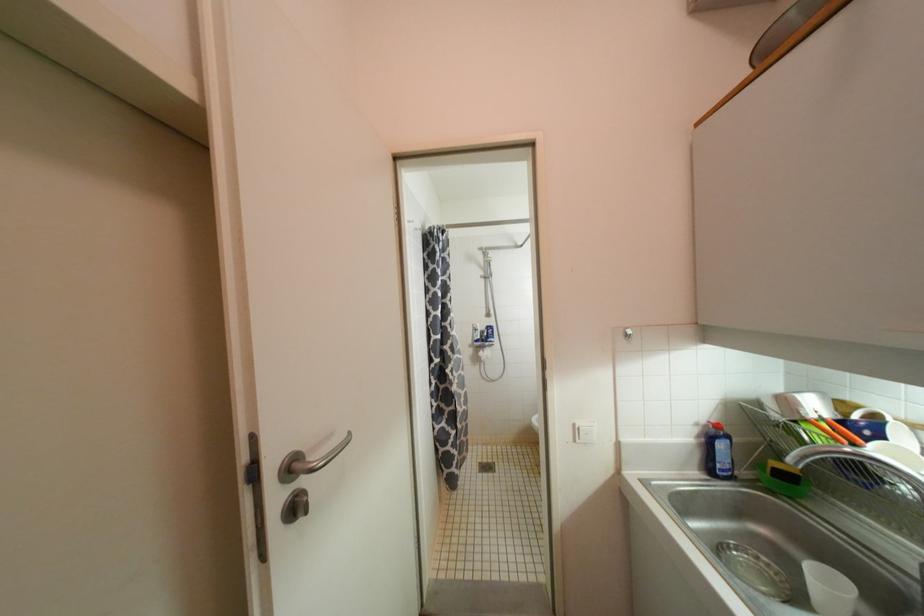
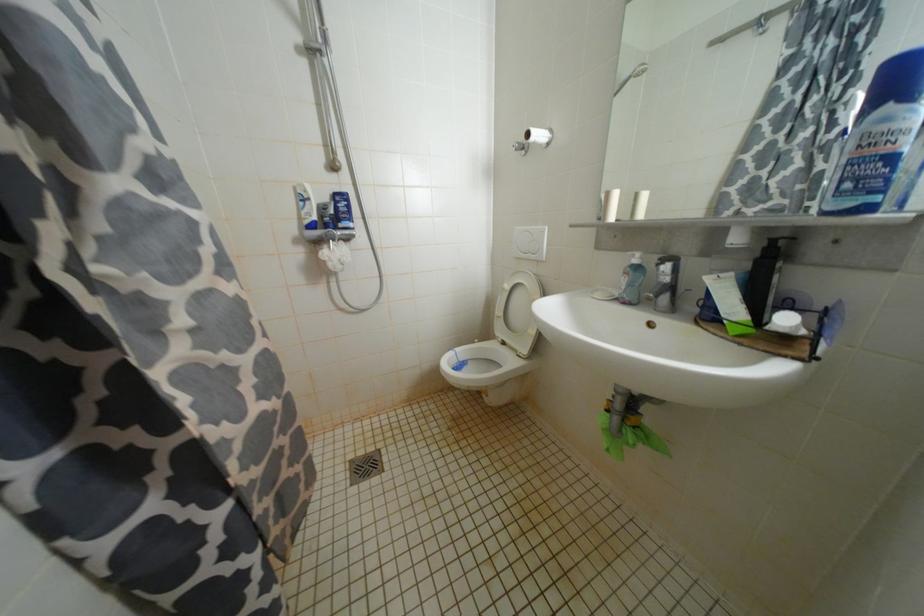
In the second image, find the point that corresponds to point 494,329 in the first image.

(345, 198)